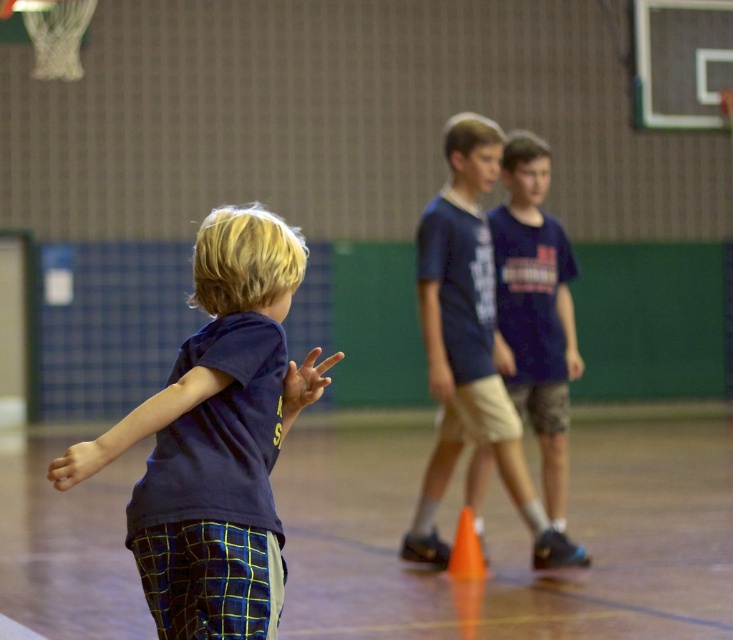
Consider the image. Is the position of navy blue shirt at center more distant than that of orange matte cone at center?

No, navy blue shirt at center is in front of orange matte cone at center.

Where is `navy blue shirt at center`? This screenshot has height=640, width=733. navy blue shirt at center is located at coordinates (216, 438).

What do you see at coordinates (216, 438) in the screenshot? I see `navy blue shirt at center` at bounding box center [216, 438].

Locate an element on the screen. navy blue shirt at center is located at coordinates (216, 438).

Does navy blue shirt at center have a lesser width compared to navy blue t-shirt at center?

Yes.

Does point (158, 442) come behind point (432, 323)?

No.

Measure the distance between point (195, 449) and camera.

Point (195, 449) and camera are 4.55 meters apart.

Find the location of a particular element. navy blue shirt at center is located at coordinates (216, 438).

Does navy blue t-shirt at center have a lesser width compared to orange matte cone at center?

Incorrect, navy blue t-shirt at center's width is not less than orange matte cone at center's.

Is navy blue t-shirt at center taller than orange matte cone at center?

Yes, navy blue t-shirt at center is taller than orange matte cone at center.

Does point (504, 476) come behind point (474, 545)?

No, (504, 476) is in front of (474, 545).

Where is `navy blue t-shirt at center`? This screenshot has height=640, width=733. navy blue t-shirt at center is located at coordinates (468, 348).